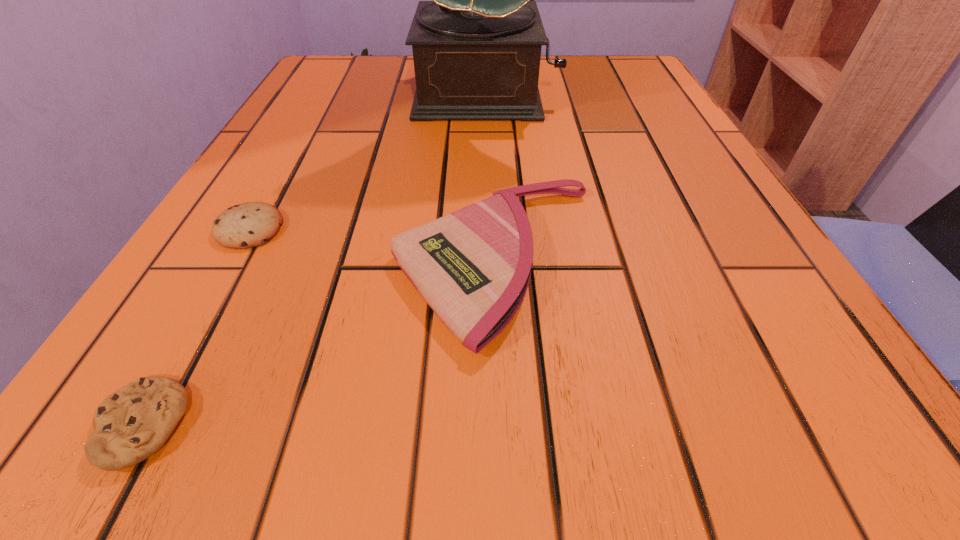
Identify the location of vacant space that's between the nearest object and the tallest object. click(314, 260).

What are the coordinates of `free space that is in between the record player and the farther cookie` in the screenshot? It's located at click(x=368, y=161).

You are a GUI agent. You are given a task and a screenshot of the screen. Output one action in this format:
    pyautogui.click(x=<x>, y=<y>)
    Task: Click on the vacant area that lies between the record player and the farther cookie
    
    Given the screenshot: What is the action you would take?
    pyautogui.click(x=368, y=161)

The image size is (960, 540). What are the coordinates of `free point between the farthest object and the farther cookie` in the screenshot? It's located at (368, 161).

Find the location of `blank region between the nearer cookie and the farther cookie`. blank region between the nearer cookie and the farther cookie is located at coordinates (195, 327).

Where is `vacant area that lies between the farther cookie and the record player`? This screenshot has width=960, height=540. vacant area that lies between the farther cookie and the record player is located at coordinates (368, 161).

At what (x,y) coordinates should I click in order to perform the action: click on vacant region between the tallest object and the nearest object. Please return your answer as a coordinate pair (x, y). This screenshot has height=540, width=960. Looking at the image, I should click on (314, 260).

This screenshot has width=960, height=540. Find the location of `vacant area between the nearer cookie and the farther cookie`. vacant area between the nearer cookie and the farther cookie is located at coordinates (195, 327).

Identify which object is the second closest to the wristlet. Please provide its 2D coordinates. Your answer should be formatted as a tuple, i.e. [(x, y)], where the tuple contains the x and y coordinates of a point satisfying the conditions above.

[(134, 422)]

Point out which object is positioned as the third nearest to the farther cookie. Please provide its 2D coordinates. Your answer should be formatted as a tuple, i.e. [(x, y)], where the tuple contains the x and y coordinates of a point satisfying the conditions above.

[(476, 47)]